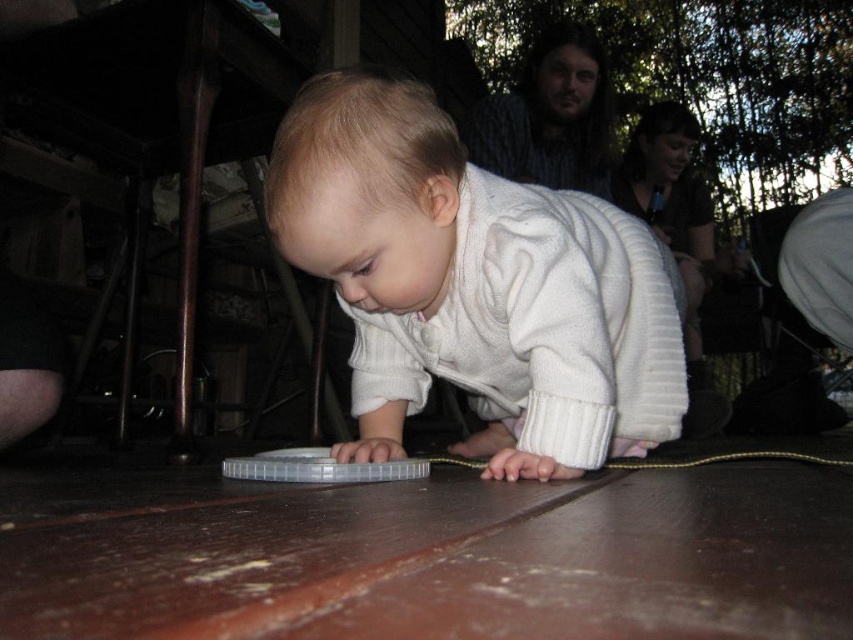
Question: Which object is farther from the camera taking this photo?

Choices:
 (A) white ribbed sweater at center
 (B) clear plastic lid at center

Answer: (A)

Question: Can you confirm if white ribbed sweater at center is positioned below clear plastic lid at center?

Choices:
 (A) no
 (B) yes

Answer: (A)

Question: Does white ribbed sweater at center appear on the left side of clear plastic lid at center?

Choices:
 (A) no
 (B) yes

Answer: (A)

Question: Which object appears closest to the camera in this image?

Choices:
 (A) white ribbed sweater at center
 (B) clear plastic lid at center

Answer: (B)

Question: Is white ribbed sweater at center wider than clear plastic lid at center?

Choices:
 (A) yes
 (B) no

Answer: (A)